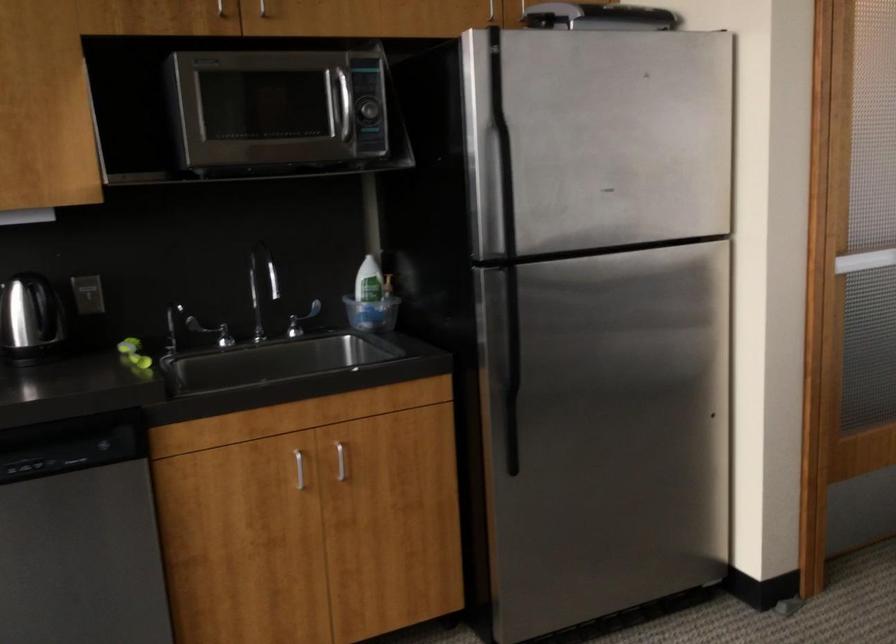
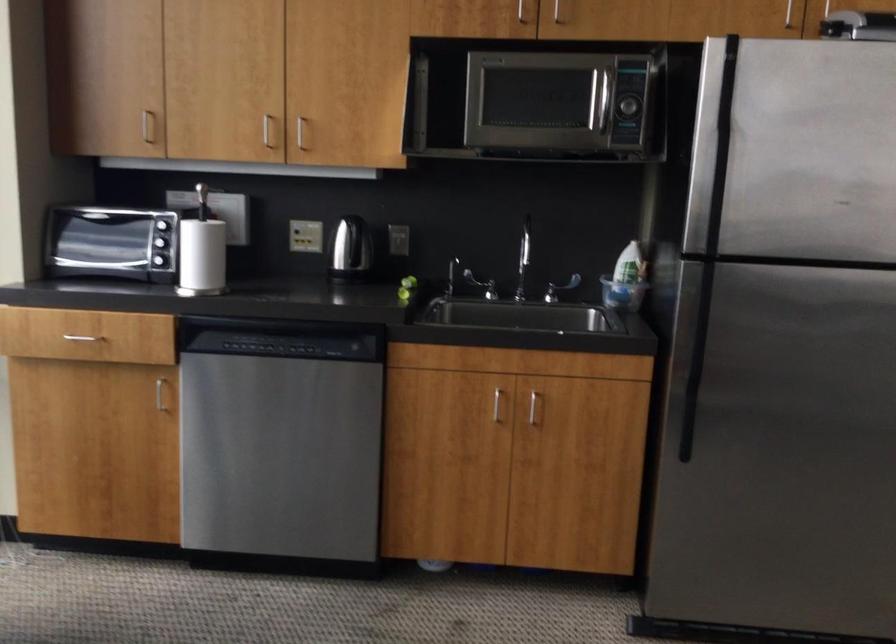
In the second image, find the point that corresponds to point (368, 111) in the first image.

(626, 106)